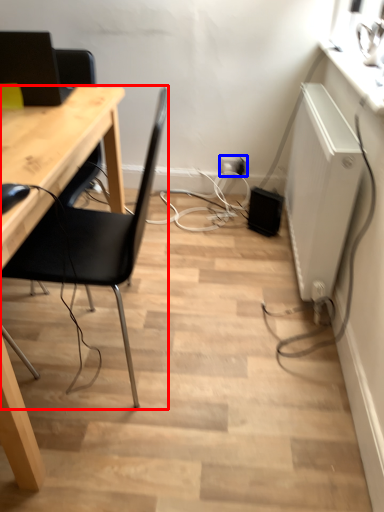
Question: Which object appears closest to the camera in this image, chair (highlighted by a red box) or electric outlet (highlighted by a blue box)?

Choices:
 (A) chair
 (B) electric outlet

Answer: (A)